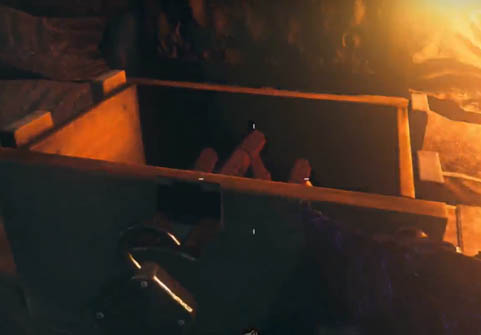
This screenshot has width=481, height=335. In order to click on fabric in this screenshot , I will do `click(458, 147)`.